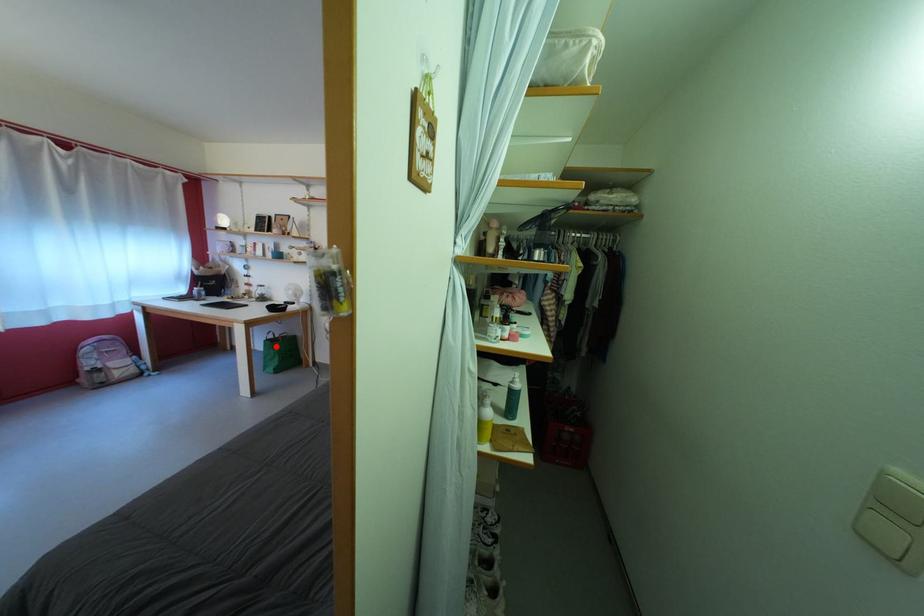
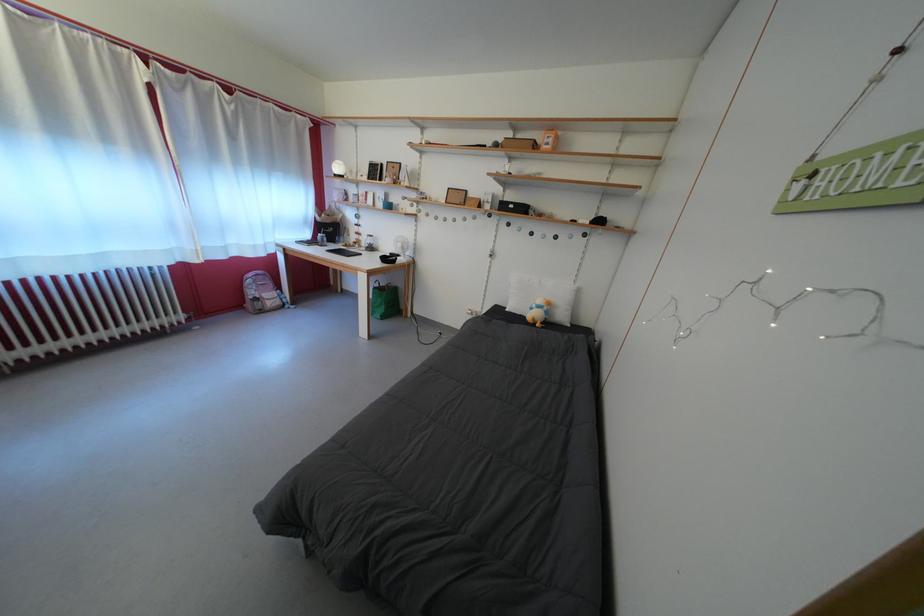
Question: I am providing you with two images of the same scene from different viewpoints. Given a red point in image1, look at the same physical point in image2. Is it:

Choices:
 (A) Closer to the viewpoint
 (B) Farther from the viewpoint

Answer: (A)